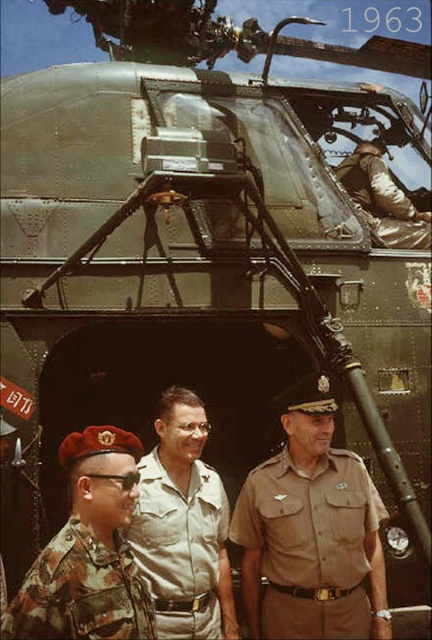
You are a photographer positioned behind the helicopter. You want to take a photo of both the camouflage fabric uniform at lower left and the tan fabric uniform at center. Which uniform is closer to you?

The camouflage fabric uniform at lower left is closer to you since it is in front of the tan fabric uniform at center.